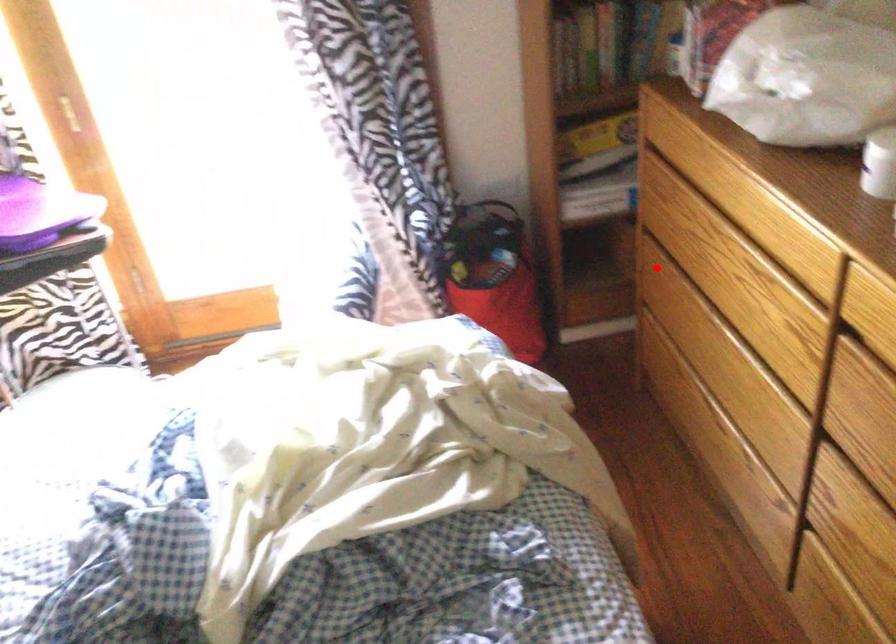
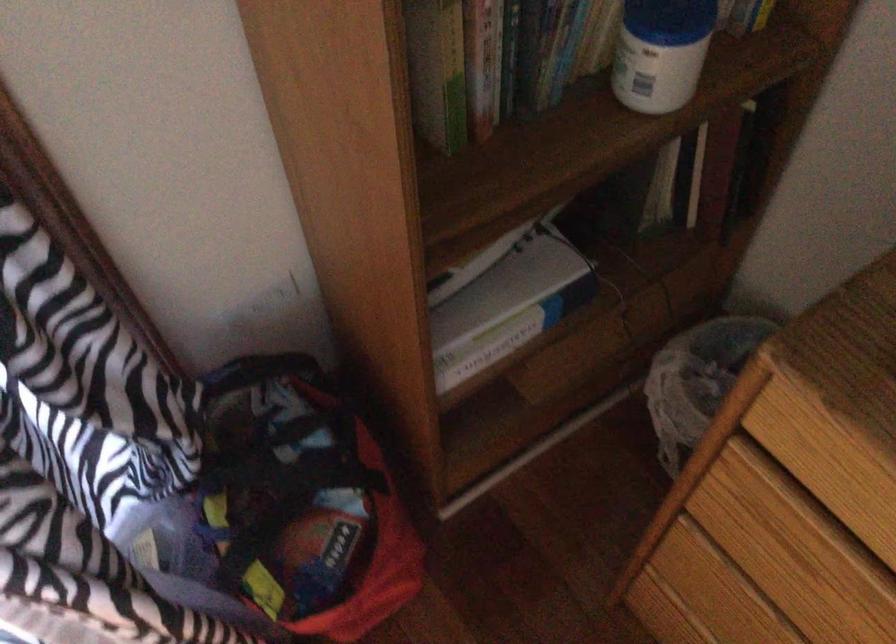
Question: A red point is marked in image1. In image2, is the corresponding 3D point closer to the camera or farther? Reply with the corresponding letter.

Choices:
 (A) The corresponding 3D point is closer.
 (B) The corresponding 3D point is farther.

Answer: (A)